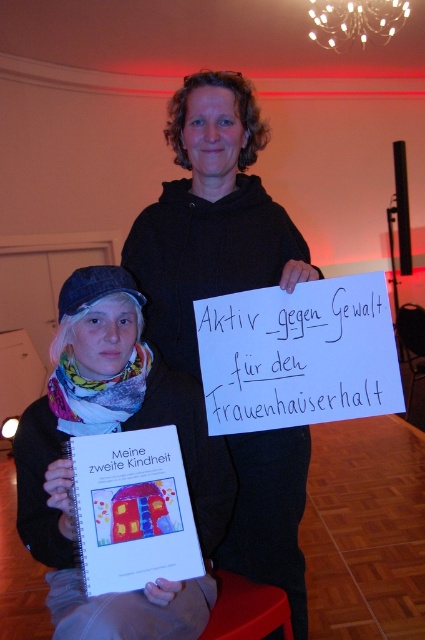
Question: Is black hoodie at center positioned before white fabric scarf at lower left?

Choices:
 (A) yes
 (B) no

Answer: (B)

Question: Can you confirm if black hoodie at center is positioned above white fabric scarf at lower left?

Choices:
 (A) yes
 (B) no

Answer: (A)

Question: Which point appears closest to the camera in this image?

Choices:
 (A) (201, 83)
 (B) (65, 349)

Answer: (B)

Question: Which point is closer to the camera?

Choices:
 (A) (278, 221)
 (B) (64, 412)

Answer: (B)

Question: Is black hoodie at center to the left of white fabric scarf at lower left from the viewer's perspective?

Choices:
 (A) no
 (B) yes

Answer: (A)